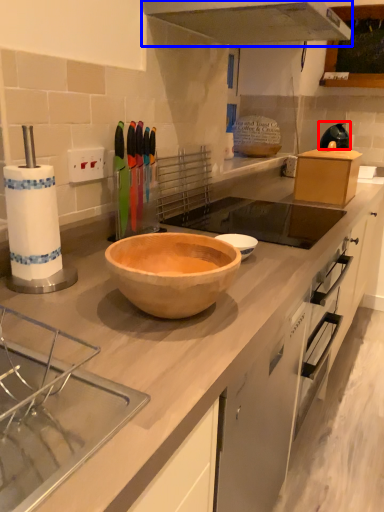
Question: Which of the following is the closest to the observer, appliance (highlighted by a red box) or exhaust hood (highlighted by a blue box)?

Choices:
 (A) appliance
 (B) exhaust hood

Answer: (B)